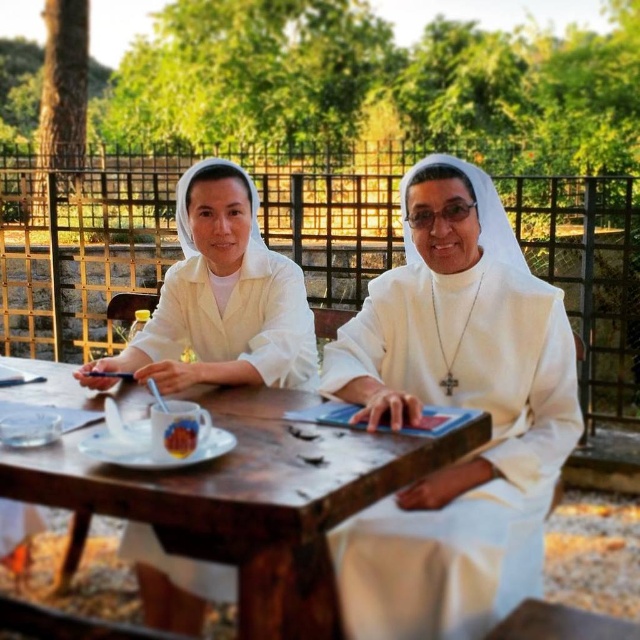
Question: Does white matte nun's habit at center have a greater width compared to smooth brown bread at center?

Choices:
 (A) no
 (B) yes

Answer: (B)

Question: Which object appears farthest from the camera in this image?

Choices:
 (A) smooth brown bread at center
 (B) white matte nun's habit at center

Answer: (B)

Question: Does white matte nun at center have a smaller size compared to smooth brown bread at center?

Choices:
 (A) yes
 (B) no

Answer: (B)

Question: Which point is farther from the camera taking this photo?

Choices:
 (A) (205, 568)
 (B) (269, 564)
 (C) (173, 433)

Answer: (A)

Question: Which of the following is the farthest from the observer?

Choices:
 (A) (396, 372)
 (B) (170, 442)

Answer: (A)

Question: Does wooden table at center have a smaller size compared to smooth brown bread at center?

Choices:
 (A) no
 (B) yes

Answer: (A)